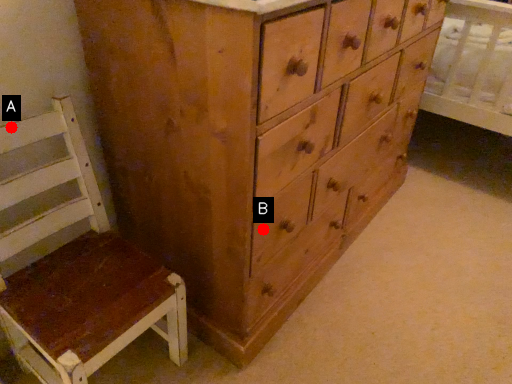
Question: Two points are circled on the image, labeled by A and B beside each circle. Which of the following is the closest to the observer?

Choices:
 (A) A is closer
 (B) B is closer

Answer: (A)